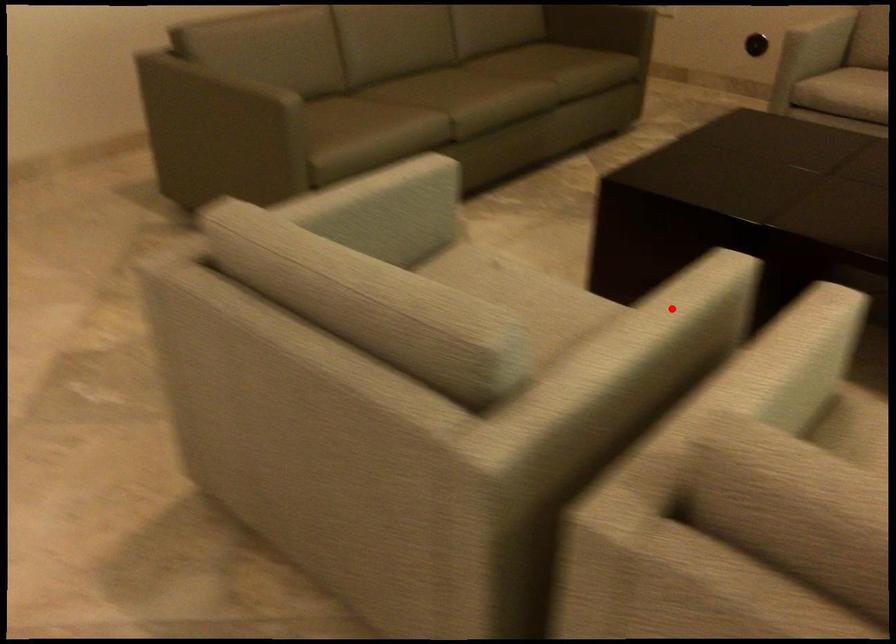
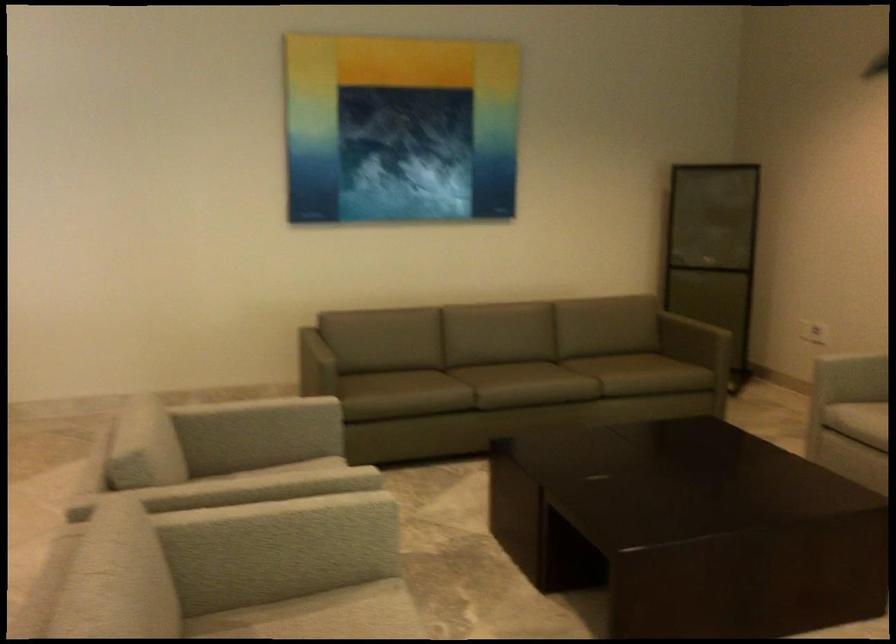
Where in the second image is the point corresponding to the highlighted location from the first image?

(254, 484)